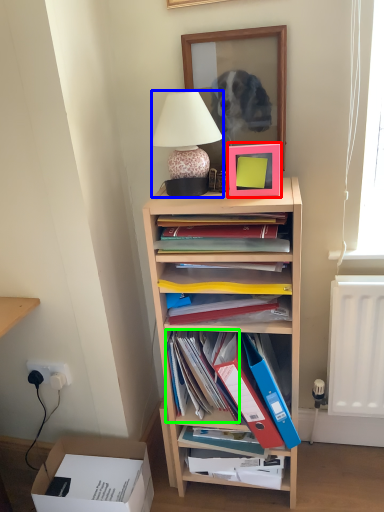
Question: Based on their relative distances, which object is nearer to picture frame (highlighted by a red box)? Choose from lamp (highlighted by a blue box) and book (highlighted by a green box).

Choices:
 (A) lamp
 (B) book

Answer: (A)